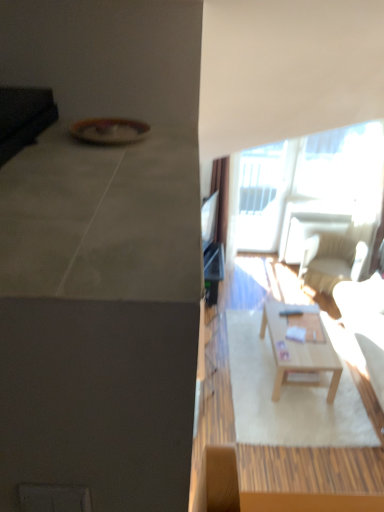
Question: Is light beige fabric chair at right thinner than matte black tv at upper right?

Choices:
 (A) no
 (B) yes

Answer: (A)

Question: Does light beige fabric chair at right touch matte black tv at upper right?

Choices:
 (A) yes
 (B) no

Answer: (B)

Question: Is light beige fabric chair at right to the left of matte black tv at upper right from the viewer's perspective?

Choices:
 (A) no
 (B) yes

Answer: (A)

Question: Is light beige fabric chair at right positioned with its back to matte black tv at upper right?

Choices:
 (A) no
 (B) yes

Answer: (A)

Question: Can you confirm if light beige fabric chair at right is smaller than matte black tv at upper right?

Choices:
 (A) no
 (B) yes

Answer: (A)

Question: Is light beige fabric chair at right aimed at matte black tv at upper right?

Choices:
 (A) yes
 (B) no

Answer: (B)

Question: From a real-world perspective, is transparent glass window at upper right positioned over light brown wooden coffee table at center based on gravity?

Choices:
 (A) yes
 (B) no

Answer: (A)

Question: Can you confirm if transparent glass window at upper right is bigger than light brown wooden coffee table at center?

Choices:
 (A) no
 (B) yes

Answer: (A)

Question: From the image's perspective, is transparent glass window at upper right beneath light brown wooden coffee table at center?

Choices:
 (A) yes
 (B) no

Answer: (B)

Question: Would you consider transparent glass window at upper right to be distant from light brown wooden coffee table at center?

Choices:
 (A) no
 (B) yes

Answer: (B)

Question: From the image's perspective, is transparent glass window at upper right over light brown wooden coffee table at center?

Choices:
 (A) no
 (B) yes

Answer: (B)

Question: Can you confirm if transparent glass window at upper right is thinner than light brown wooden coffee table at center?

Choices:
 (A) no
 (B) yes

Answer: (B)

Question: Does light brown wooden coffee table at center have a greater width compared to matte black tv at upper right?

Choices:
 (A) yes
 (B) no

Answer: (A)